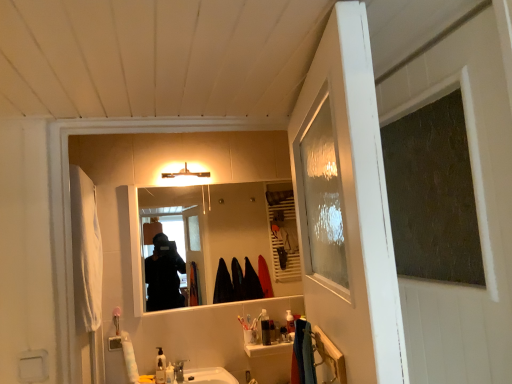
Question: Does translucent plastic soap dispenser at lower center, which ranks as the third toiletry in back-to-front order, come behind translucent plastic toothbrush holder at center, the 2th toiletry from the back?

Choices:
 (A) no
 (B) yes

Answer: (A)

Question: Is translucent plastic soap dispenser at lower center, marked as the third toiletry in a front-to-back arrangement, not close to translucent plastic toothbrush holder at center, arranged as the fourth toiletry when viewed from the left?

Choices:
 (A) yes
 (B) no

Answer: (B)

Question: From a real-world perspective, is translucent plastic soap dispenser at lower center, which ranks as the third toiletry in back-to-front order, positioned over translucent plastic toothbrush holder at center, arranged as the fourth toiletry when viewed from the left, based on gravity?

Choices:
 (A) no
 (B) yes

Answer: (A)

Question: Is translucent plastic soap dispenser at lower center, placed as the 1th toiletry when sorted from left to right, to the right of translucent plastic toothbrush holder at center, the 2th toiletry from the back, from the viewer's perspective?

Choices:
 (A) no
 (B) yes

Answer: (A)

Question: From the image's perspective, is translucent plastic soap dispenser at lower center, acting as the 5th toiletry starting from the right, located above translucent plastic toothbrush holder at center, arranged as the 4th toiletry when viewed from the front?

Choices:
 (A) no
 (B) yes

Answer: (A)

Question: Considering the positions of matte white light fixture at upper center and satin nickel faucet at sink center in the image, is matte white light fixture at upper center wider or thinner than satin nickel faucet at sink center?

Choices:
 (A) wide
 (B) thin

Answer: (A)

Question: In terms of height, does matte white light fixture at upper center look taller or shorter compared to satin nickel faucet at sink center?

Choices:
 (A) tall
 (B) short

Answer: (A)

Question: Would you say matte white light fixture at upper center is to the left or to the right of satin nickel faucet at sink center in the picture?

Choices:
 (A) left
 (B) right

Answer: (A)

Question: Based on their sizes in the image, would you say matte white light fixture at upper center is bigger or smaller than satin nickel faucet at sink center?

Choices:
 (A) big
 (B) small

Answer: (A)

Question: Is point (159, 365) positioned closer to the camera than point (257, 251)?

Choices:
 (A) farther
 (B) closer

Answer: (B)

Question: Based on their sizes in the image, would you say translucent plastic soap dispenser at lower center, marked as the third toiletry in a front-to-back arrangement, is bigger or smaller than smooth reflective mirror at center?

Choices:
 (A) small
 (B) big

Answer: (A)

Question: From a real-world perspective, is translucent plastic soap dispenser at lower center, acting as the 5th toiletry starting from the right, positioned above or below smooth reflective mirror at center?

Choices:
 (A) below
 (B) above

Answer: (A)

Question: Would you say translucent plastic soap dispenser at lower center, which ranks as the third toiletry in back-to-front order, is inside or outside smooth reflective mirror at center?

Choices:
 (A) inside
 (B) outside

Answer: (B)

Question: In terms of size, does smooth reflective mirror at center appear bigger or smaller than translucent plastic soap dispenser at lower center, acting as the first toiletry starting from the front?

Choices:
 (A) small
 (B) big

Answer: (B)

Question: Considering the positions of smooth reflective mirror at center and translucent plastic soap dispenser at lower center, the 2th toiletry from the left, in the image, is smooth reflective mirror at center wider or thinner than translucent plastic soap dispenser at lower center, the 2th toiletry from the left,?

Choices:
 (A) wide
 (B) thin

Answer: (B)